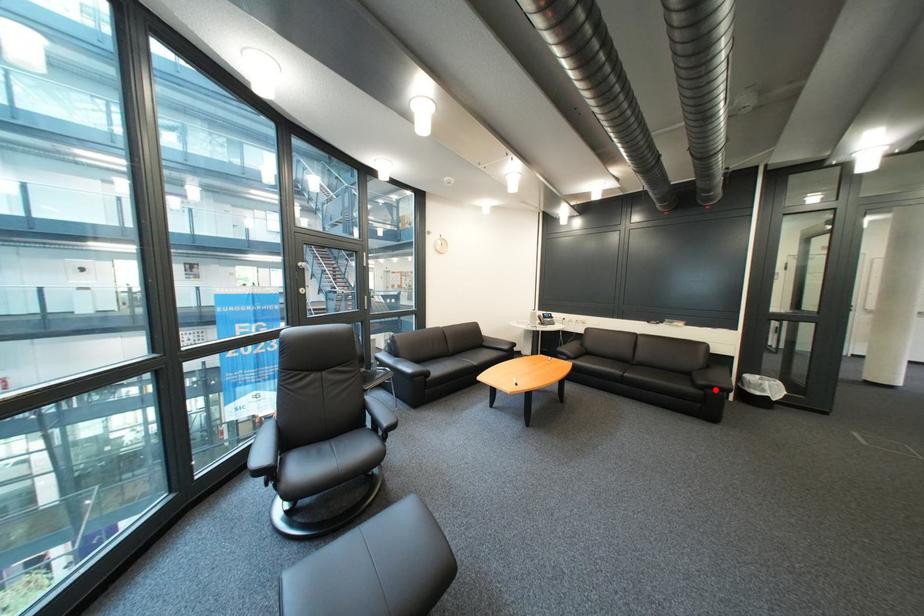
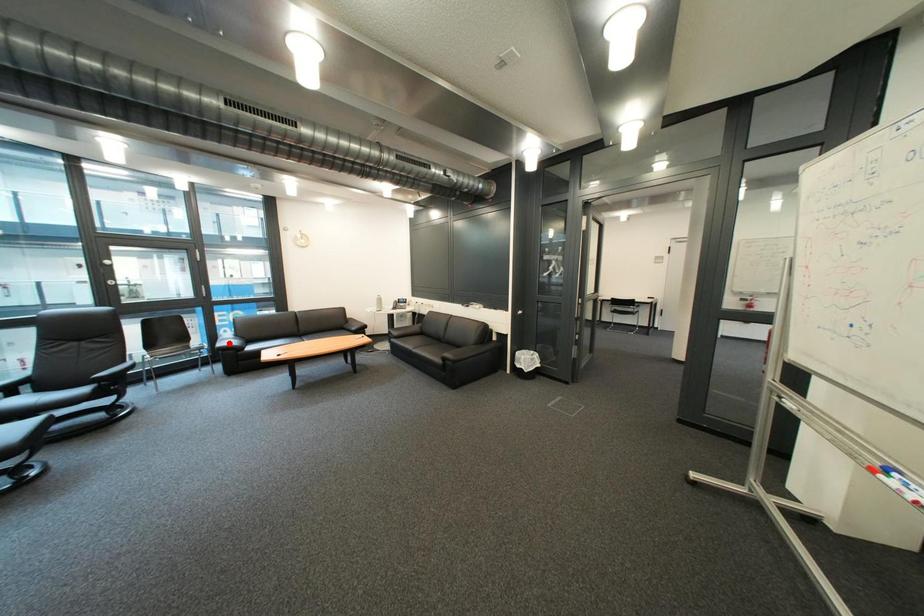
I am providing you with two images of the same scene from different viewpoints. A red point is marked on the first image and another point is marked on the second image. Do the highlighted points in image1 and image2 indicate the same real-world spot?

No